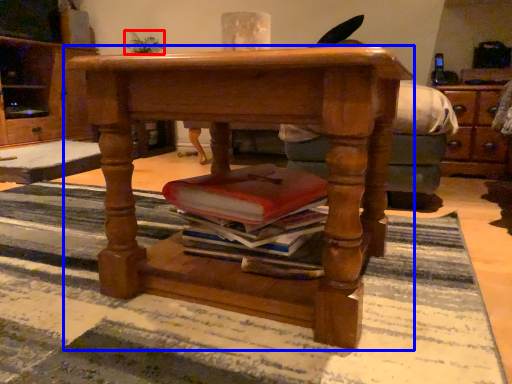
Question: Among these objects, which one is farthest to the camera, houseplant (highlighted by a red box) or desk (highlighted by a blue box)?

Choices:
 (A) houseplant
 (B) desk

Answer: (A)